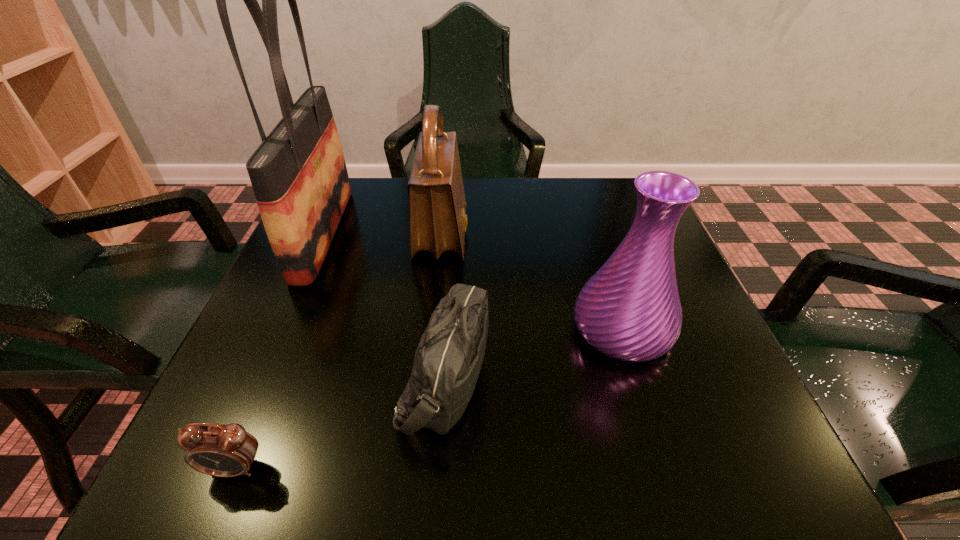
The width and height of the screenshot is (960, 540). I want to click on vacant space situated 0.350m at the front padded panel of the nearer shoulder bag, so click(x=705, y=379).

This screenshot has width=960, height=540. I want to click on shopping bag that is positioned at the far edge, so click(x=299, y=177).

Where is `shoulder bag located in the far edge section of the desktop`? shoulder bag located in the far edge section of the desktop is located at coordinates (438, 220).

This screenshot has width=960, height=540. I want to click on shoulder bag that is at the near edge, so click(447, 363).

Find the location of a particular element. Image resolution: width=960 pixels, height=540 pixels. alarm clock at the near edge is located at coordinates (217, 450).

Locate an element on the screen. Image resolution: width=960 pixels, height=540 pixels. shopping bag located at the left edge is located at coordinates (299, 177).

Image resolution: width=960 pixels, height=540 pixels. Find the location of `alarm clock that is at the left edge`. alarm clock that is at the left edge is located at coordinates (217, 450).

This screenshot has height=540, width=960. Identify the location of object that is at the right edge. (630, 310).

In order to click on object that is at the far left corner in this screenshot , I will do `click(299, 177)`.

The width and height of the screenshot is (960, 540). In order to click on object that is positioned at the near left corner in this screenshot , I will do `click(217, 450)`.